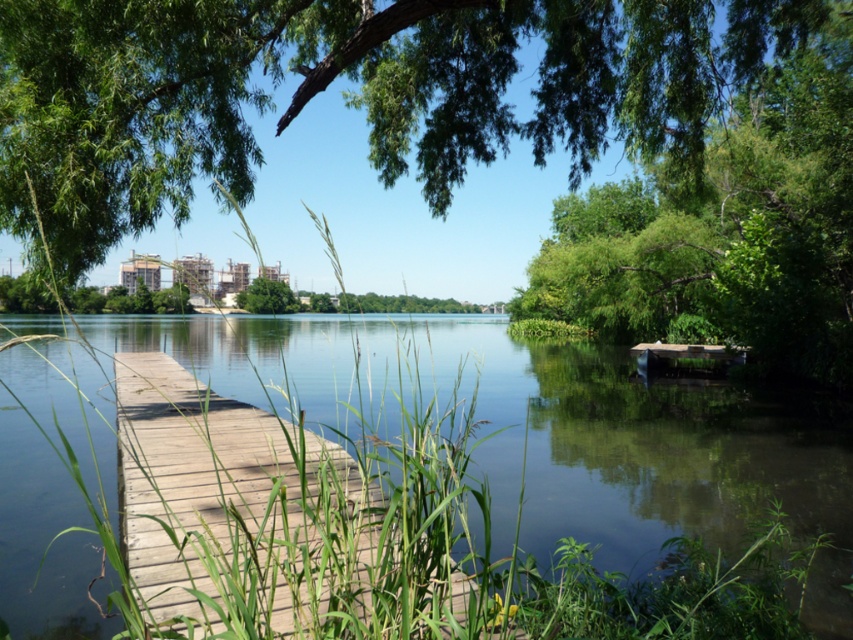
You are planning to build a small boat that is 3 meters wide. You want to navigate through the area between the clear water at dock center and the green leafy tree at right. Can your boat pass through this space?

The clear water at dock center is wider than the green leafy tree at right, so the boat can pass through the space between them as the width is sufficient for a 3 meter wide boat.